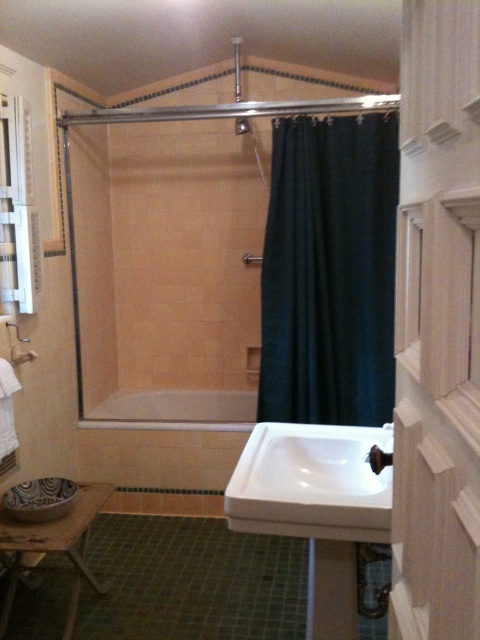
Between white glossy sink at center and white ceramic faucet at lower center, which one appears on the left side from the viewer's perspective?

white glossy sink at center is more to the left.

Does white glossy sink at center appear on the left side of white ceramic faucet at lower center?

Yes, white glossy sink at center is to the left of white ceramic faucet at lower center.

Between point (286, 433) and point (385, 452), which one is positioned behind?

Positioned behind is point (286, 433).

Where is `white glossy sink at center`? This screenshot has height=640, width=480. white glossy sink at center is located at coordinates (311, 483).

Does white wood screen door at center appear on the left side of white glossy bathtub at center?

Incorrect, white wood screen door at center is not on the left side of white glossy bathtub at center.

Image resolution: width=480 pixels, height=640 pixels. What do you see at coordinates (437, 326) in the screenshot?
I see `white wood screen door at center` at bounding box center [437, 326].

Find the location of a particular element. This screenshot has height=640, width=480. white wood screen door at center is located at coordinates (437, 326).

The width and height of the screenshot is (480, 640). Describe the element at coordinates (330, 272) in the screenshot. I see `dark green fabric at center` at that location.

Find the location of a particular element. This screenshot has width=480, height=640. dark green fabric at center is located at coordinates (330, 272).

Where is `dark green fabric at center`? dark green fabric at center is located at coordinates (330, 272).